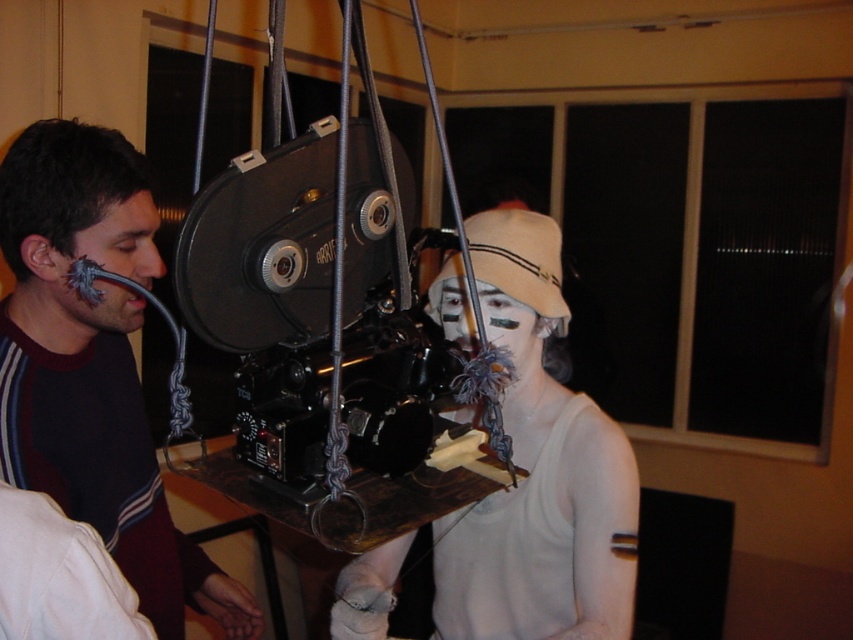
Is matte black shirt at center closer to the viewer compared to matte black face at left?

Yes, matte black shirt at center is in front of matte black face at left.

Between point (103, 420) and point (149, 276), which one is positioned behind?

Point (103, 420)

Locate an element on the screen. matte black shirt at center is located at coordinates (93, 365).

Can you confirm if matte black shirt at center is wider than white matte face at center?

Indeed, matte black shirt at center has a greater width compared to white matte face at center.

Who is lower down, matte black shirt at center or white matte face at center?

Positioned lower is matte black shirt at center.

Does point (16, 321) lie behind point (466, 330)?

No, it is in front of (466, 330).

Locate an element on the screen. matte black shirt at center is located at coordinates (93, 365).

Who is positioned more to the right, matte black face at left or white matte face at center?

white matte face at center is more to the right.

Which of these two, matte black face at left or white matte face at center, stands taller?

matte black face at left

The width and height of the screenshot is (853, 640). What are the coordinates of `matte black face at left` in the screenshot? It's located at (105, 268).

This screenshot has width=853, height=640. I want to click on matte black face at left, so click(x=105, y=268).